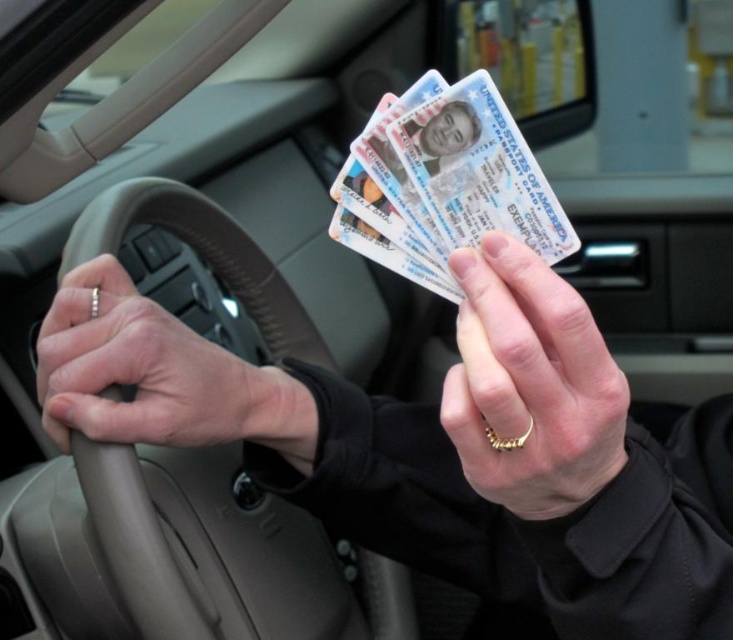
Question: From the image, what is the correct spatial relationship of gold ring at left in relation to white plastic id cards at center?

Choices:
 (A) below
 (B) above

Answer: (A)

Question: Estimate the real-world distances between objects in this image. Which object is closer to the gold ring at left?

Choices:
 (A) white plastic id cards at center
 (B) gold ring at center

Answer: (A)

Question: Can you confirm if gold ring at left is thinner than white plastic id cards at center?

Choices:
 (A) no
 (B) yes

Answer: (A)

Question: Does gold ring at center appear on the right side of gold ring at left?

Choices:
 (A) no
 (B) yes

Answer: (B)

Question: Which point is farther from the camera taking this photo?

Choices:
 (A) (564, 333)
 (B) (339, 195)

Answer: (B)

Question: Which point appears farthest from the camera in this image?

Choices:
 (A) (410, 172)
 (B) (476, 387)

Answer: (A)